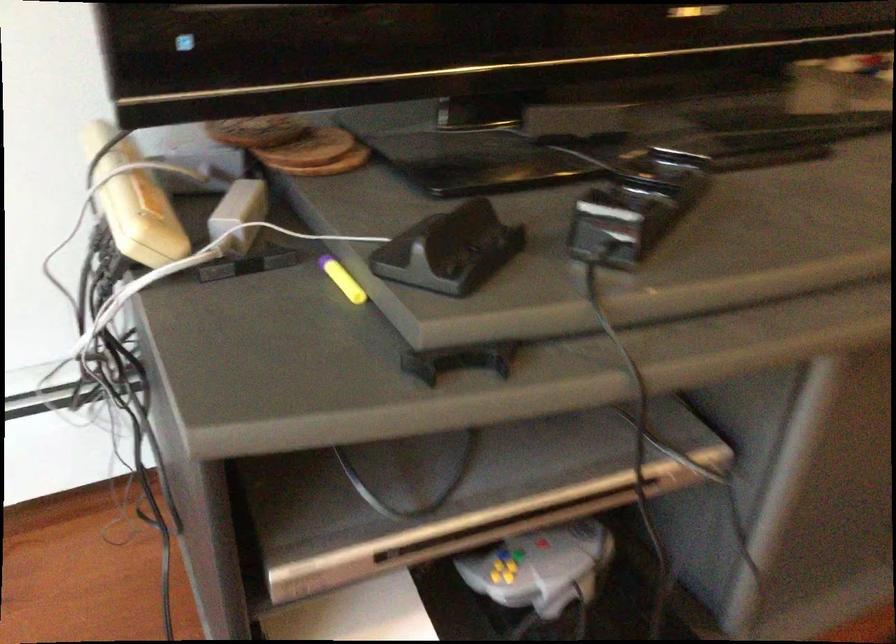
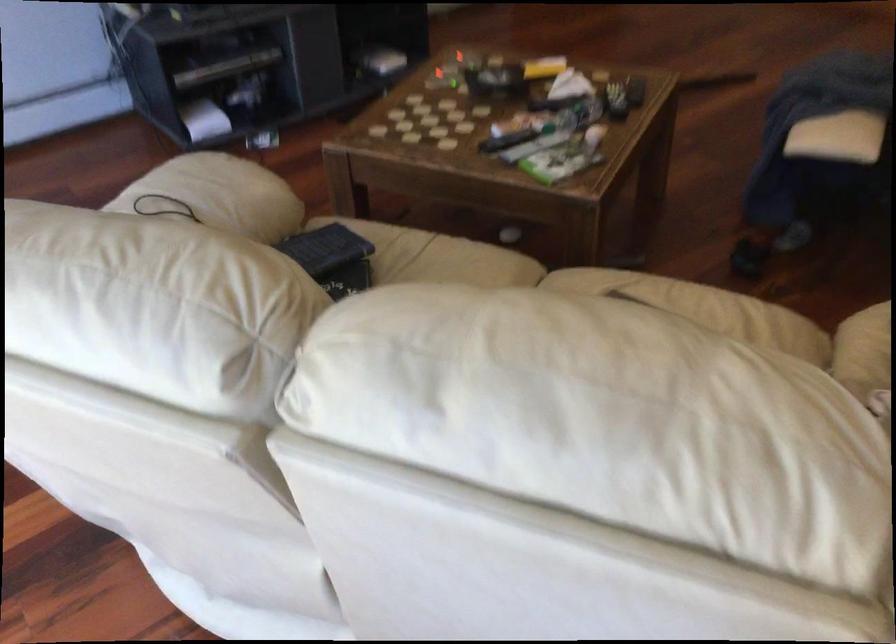
Question: In a continuous first-person perspective shot, in which direction is the camera moving?

Choices:
 (A) Left
 (B) Right
 (C) Forward
 (D) Backward

Answer: (D)